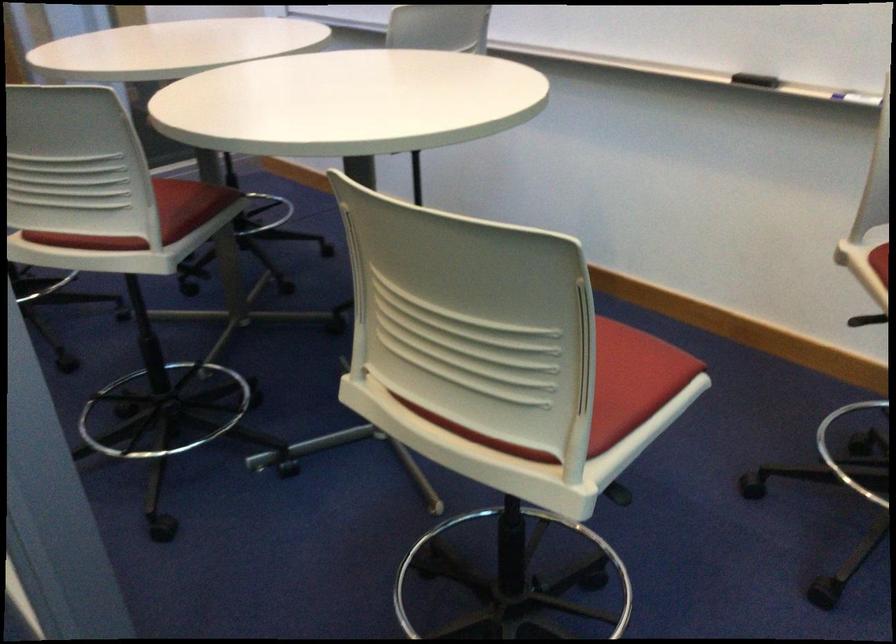
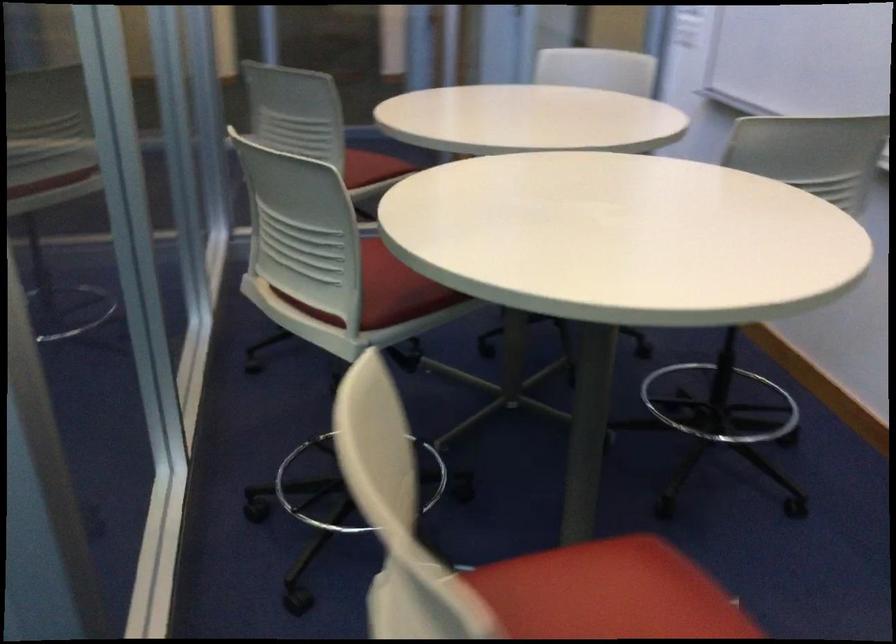
Question: Based on the continuous images, in which direction is the camera rotating? Reply with the corresponding letter.

Choices:
 (A) Left
 (B) Right
 (C) Up
 (D) Down

Answer: (A)